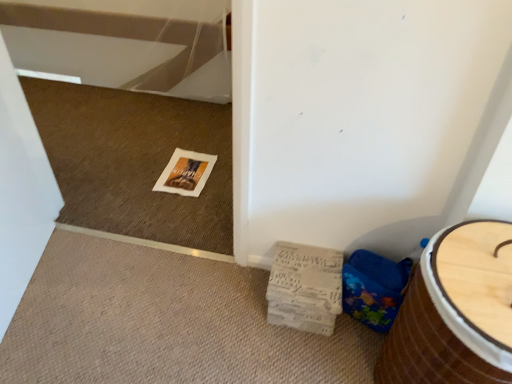
Question: Should I look upward or downward to see white cardboard magazine at lower right?

Choices:
 (A) down
 (B) up

Answer: (A)

Question: Is white cardboard magazine at lower right at the left side of wooden barrel at lower right?

Choices:
 (A) yes
 (B) no

Answer: (A)

Question: Can you confirm if white cardboard magazine at lower right is shorter than wooden barrel at lower right?

Choices:
 (A) no
 (B) yes

Answer: (B)

Question: Is white cardboard magazine at lower right further to camera compared to wooden barrel at lower right?

Choices:
 (A) no
 (B) yes

Answer: (B)

Question: Is wooden barrel at lower right a part of white cardboard magazine at lower right?

Choices:
 (A) no
 (B) yes

Answer: (A)

Question: Is white cardboard magazine at lower right taller than wooden barrel at lower right?

Choices:
 (A) yes
 (B) no

Answer: (B)

Question: Does white cardboard magazine at lower right touch wooden barrel at lower right?

Choices:
 (A) no
 (B) yes

Answer: (A)

Question: Is wooden barrel at lower right at the right side of white cardboard magazine at lower right?

Choices:
 (A) yes
 (B) no

Answer: (A)

Question: Is wooden barrel at lower right thinner than white cardboard magazine at lower right?

Choices:
 (A) yes
 (B) no

Answer: (B)

Question: Is wooden barrel at lower right bigger than white cardboard magazine at lower right?

Choices:
 (A) no
 (B) yes

Answer: (B)

Question: Is wooden barrel at lower right with white cardboard magazine at lower right?

Choices:
 (A) yes
 (B) no

Answer: (B)

Question: Considering the relative positions of wooden barrel at lower right and white cardboard magazine at lower right in the image provided, is wooden barrel at lower right in front of white cardboard magazine at lower right?

Choices:
 (A) no
 (B) yes

Answer: (B)

Question: Is wooden barrel at lower right surrounding white cardboard magazine at lower right?

Choices:
 (A) yes
 (B) no

Answer: (B)

Question: From the image's perspective, is wooden barrel at lower right under blue fabric potty at lower right?

Choices:
 (A) yes
 (B) no

Answer: (A)